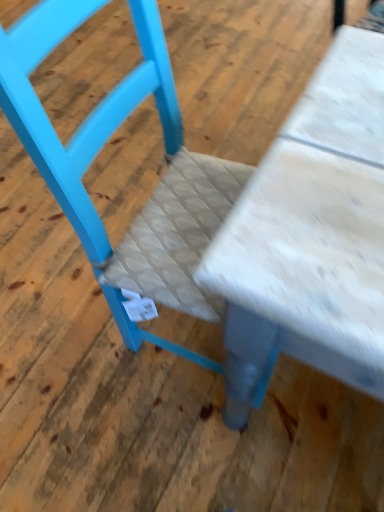
Measure the distance between point [297,350] and camera.

Point [297,350] and camera are 62.20 centimeters apart.

What do you see at coordinates (311, 234) in the screenshot? I see `white matte table at center` at bounding box center [311, 234].

You are a GUI agent. You are given a task and a screenshot of the screen. Output one action in this format:
    pyautogui.click(x=<x>, y=<y>)
    Task: Click on the white matte table at center
    The height and width of the screenshot is (512, 384).
    Given the screenshot: What is the action you would take?
    pyautogui.click(x=311, y=234)

At what (x,y) coordinates should I click in order to perform the action: click on white matte table at center. Please return your answer as a coordinate pair (x, y). This screenshot has width=384, height=512. Looking at the image, I should click on pos(311,234).